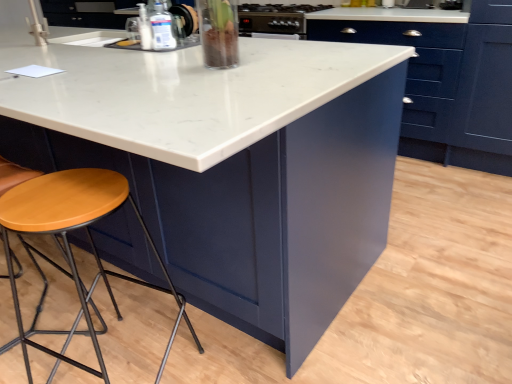
Question: Does clear glass vase at upper center, the second appliance positioned from the top, turn towards wooden seat at lower left?

Choices:
 (A) yes
 (B) no

Answer: (B)

Question: Does clear glass vase at upper center, the second appliance positioned from the top, have a greater height compared to wooden seat at lower left?

Choices:
 (A) no
 (B) yes

Answer: (A)

Question: Is clear glass vase at upper center, which is the 2th appliance in back-to-front order, positioned beyond the bounds of wooden seat at lower left?

Choices:
 (A) no
 (B) yes

Answer: (B)

Question: From the image's perspective, does clear glass vase at upper center, the second appliance positioned from the top, appear lower than wooden seat at lower left?

Choices:
 (A) yes
 (B) no

Answer: (B)

Question: Is clear glass vase at upper center, the second appliance positioned from the top, oriented away from wooden seat at lower left?

Choices:
 (A) no
 (B) yes

Answer: (A)

Question: In terms of width, does metallic stainless steel oven at upper center, acting as the 1th appliance starting from the top, look wider or thinner when compared to matte blue cabinet at center?

Choices:
 (A) thin
 (B) wide

Answer: (B)

Question: From the image's perspective, relative to matte blue cabinet at center, is metallic stainless steel oven at upper center, the second appliance in the left-to-right sequence, above or below?

Choices:
 (A) below
 (B) above

Answer: (B)

Question: Is metallic stainless steel oven at upper center, acting as the first appliance starting from the back, taller or shorter than matte blue cabinet at center?

Choices:
 (A) tall
 (B) short

Answer: (B)

Question: Which is correct: metallic stainless steel oven at upper center, the second appliance in the left-to-right sequence, is inside matte blue cabinet at center, or outside of it?

Choices:
 (A) outside
 (B) inside

Answer: (A)

Question: From the image's perspective, is wooden seat stool at lower left located above or below wooden seat at lower left?

Choices:
 (A) above
 (B) below

Answer: (B)

Question: Is wooden seat stool at lower left taller or shorter than wooden seat at lower left?

Choices:
 (A) short
 (B) tall

Answer: (A)

Question: Considering the positions of point (6, 220) and point (80, 178), is point (6, 220) closer or farther from the camera than point (80, 178)?

Choices:
 (A) farther
 (B) closer

Answer: (B)

Question: From a real-world perspective, is wooden seat stool at lower left physically located above or below wooden seat at lower left?

Choices:
 (A) below
 (B) above

Answer: (A)

Question: In terms of height, does wooden seat at lower left look taller or shorter compared to wooden seat stool at lower left?

Choices:
 (A) tall
 (B) short

Answer: (A)

Question: Considering the positions of point (97, 205) and point (76, 322), is point (97, 205) closer or farther from the camera than point (76, 322)?

Choices:
 (A) closer
 (B) farther

Answer: (A)